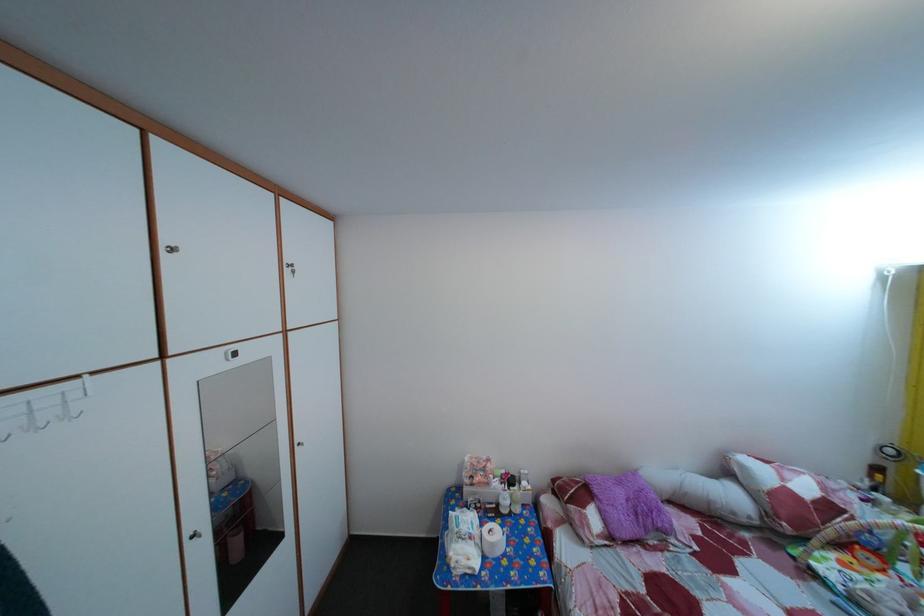
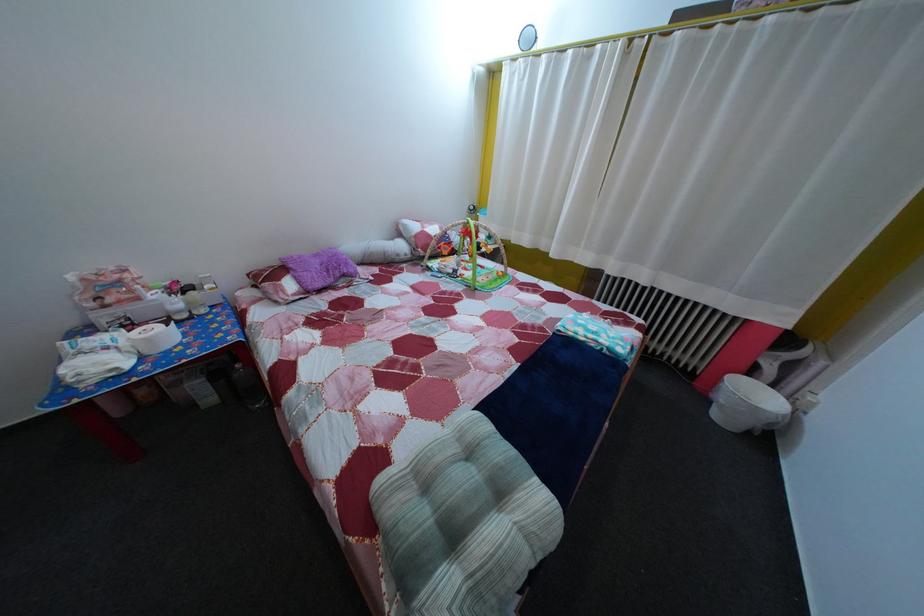
Where in the second image is the point corresponding to the point at 629,491 from the first image?

(325, 262)